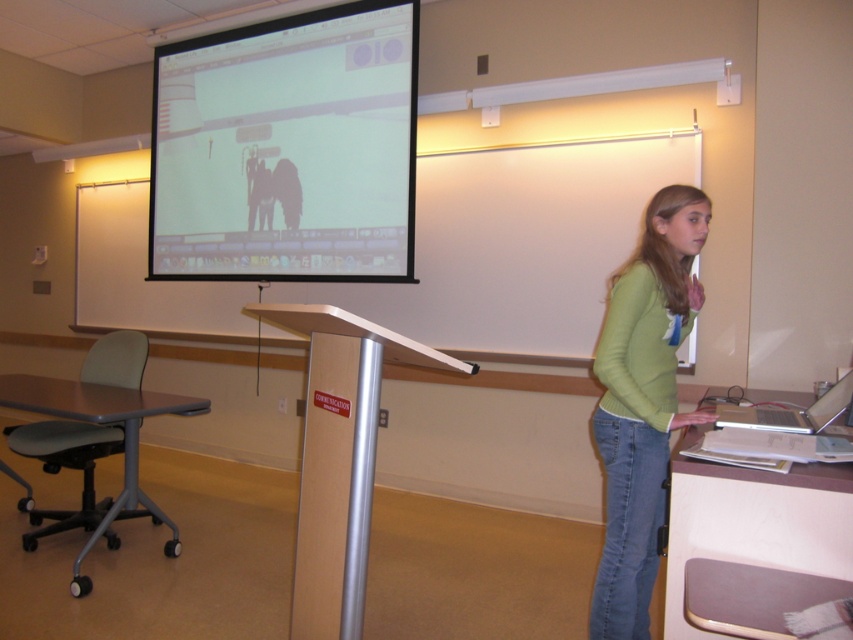
Question: Where is green matte shirt at center located in relation to light brown wooden table at lower right in the image?

Choices:
 (A) left
 (B) right

Answer: (A)

Question: Is green matte shirt at center thinner than light brown wooden table at lower right?

Choices:
 (A) yes
 (B) no

Answer: (A)

Question: Which point is closer to the camera?

Choices:
 (A) light brown wooden table at lower right
 (B) silver metallic laptop at right
 (C) white matte projection screen at upper center

Answer: (A)

Question: Is white matte projection screen at upper center above light brown laminate table at lower left?

Choices:
 (A) yes
 (B) no

Answer: (A)

Question: Which of the following is the farthest from the observer?

Choices:
 (A) (90, 384)
 (B) (345, 132)

Answer: (B)

Question: Which of these objects is positioned closest to the green matte shirt at center?

Choices:
 (A) light brown wooden table at lower right
 (B) silver metallic laptop at right
 (C) white matte projection screen at upper center
 (D) light brown laminate table at lower left

Answer: (B)